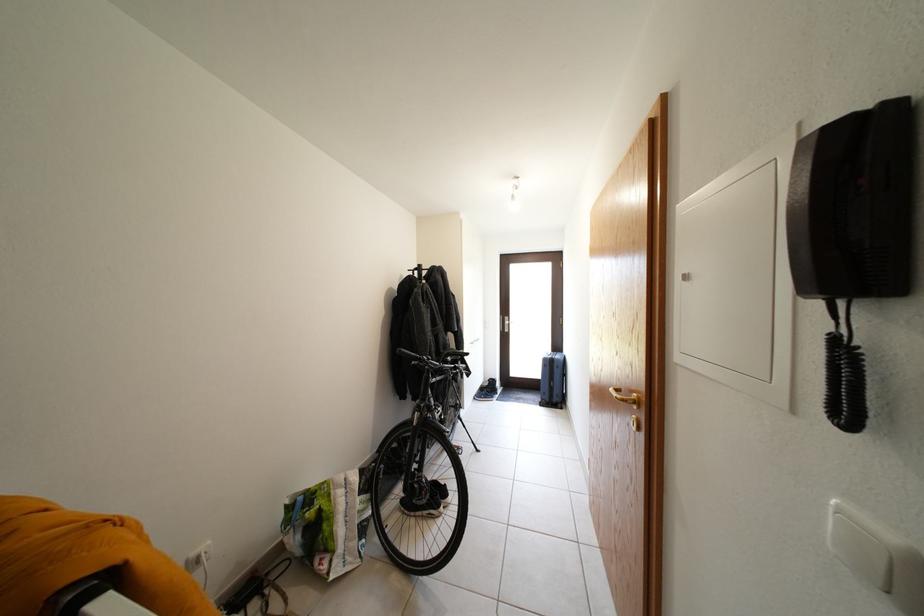
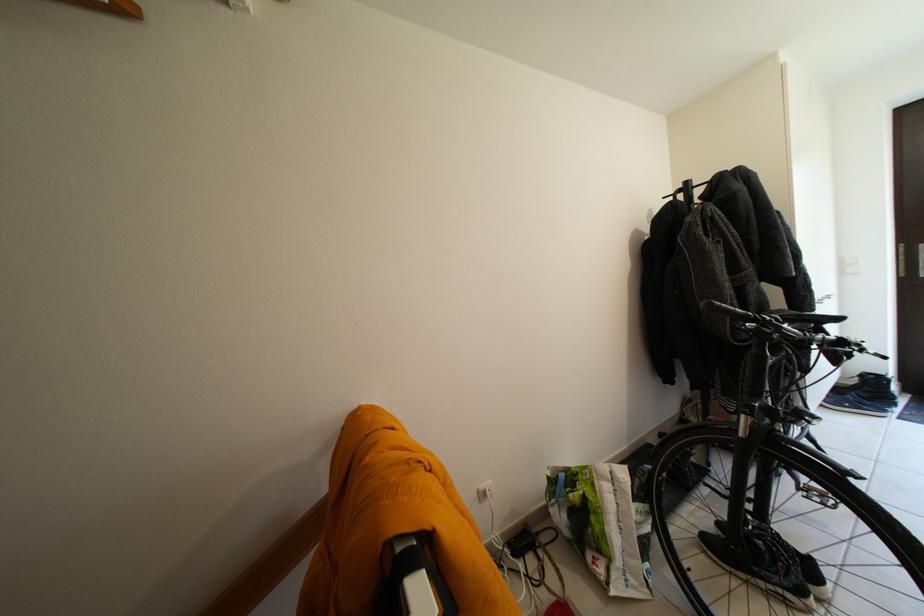
Question: The first image is from the beginning of the video and the second image is from the end. How did the camera likely rotate when shooting the video?

Choices:
 (A) Left
 (B) Right
 (C) Up
 (D) Down

Answer: (A)